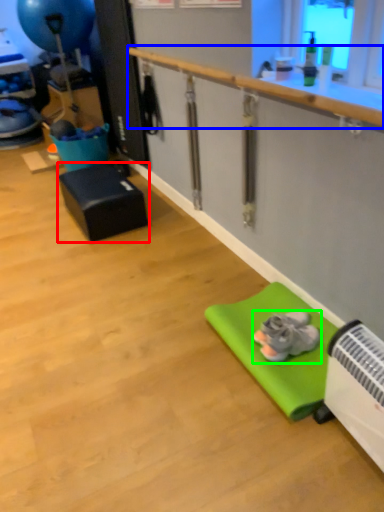
Question: Estimate the real-world distances between objects in this image. Which object is farther from furniture (highlighted by a red box), rail (highlighted by a blue box) or footwear (highlighted by a green box)?

Choices:
 (A) rail
 (B) footwear

Answer: (B)